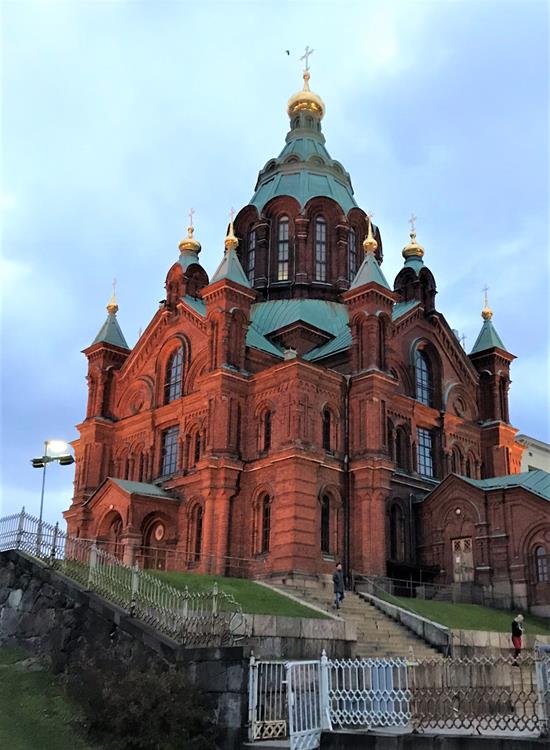
Find the location of a particular element. circular window is located at coordinates (158, 531), (458, 511).